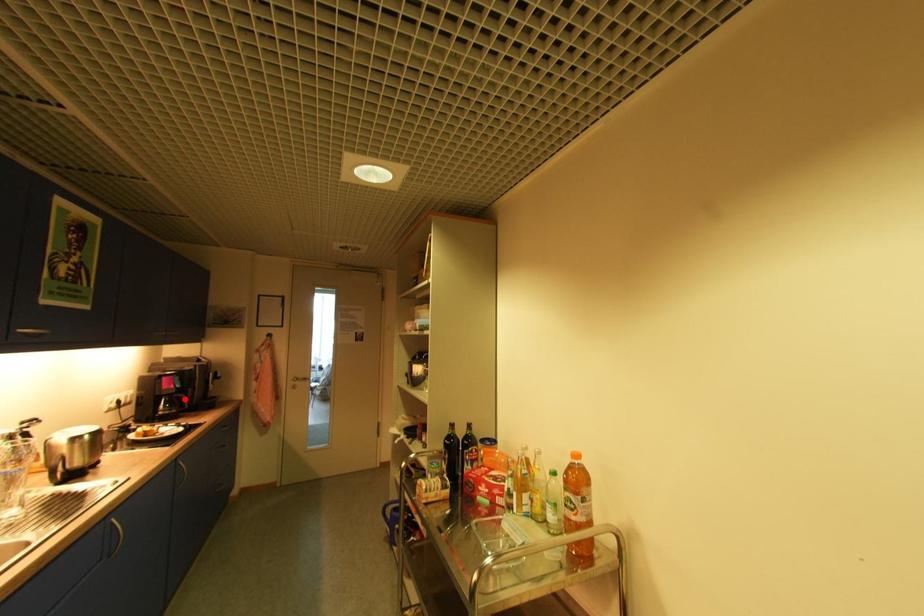
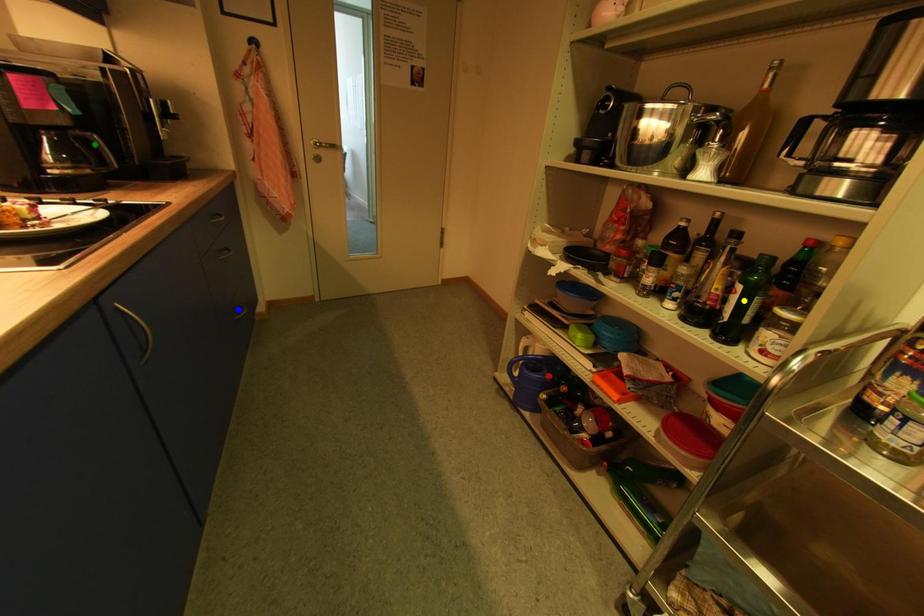
Question: I am providing you with two images of the same scene from different viewpoints. A red point is marked on the first image. You are given multiple points on the second image. Can you choose the point in image 2 that corresponds to the point in image 1?

Choices:
 (A) green point
 (B) yellow point
 (C) blue point

Answer: (A)